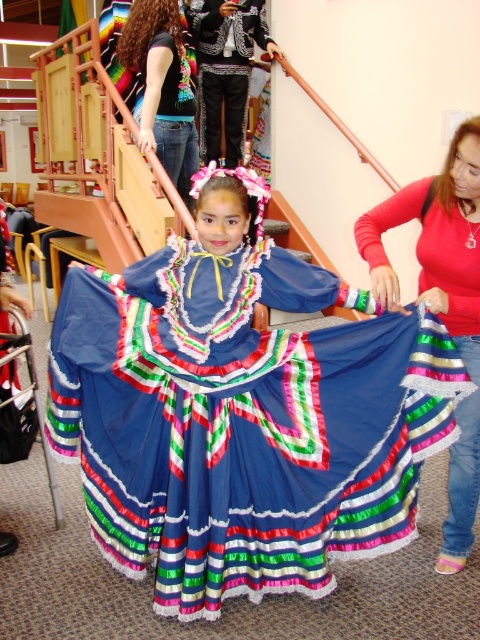
You are organizing a fashion show and need to arrange the matte blue skirt at center and jeans at upper left in a display case. The case has limited space. Which item should you choose to prioritize if you want to maximize the number of items displayed?

The matte blue skirt at center occupies less space than jeans at upper left, so you should prioritize displaying the matte blue skirt at center to fit more items in the display case.

You are a photographer standing at a certain distance from the matte blue skirt at center. You need to capture a full body shot of the girl in her traditional attire. Considering the space between you and the skirt, can you comfortably step forward to get a closer shot without invading her personal space?

The distance between you and the matte blue skirt at center is 1.86 meters. This distance is sufficient to comfortably step forward a bit for a closer shot while maintaining respect for her personal space.